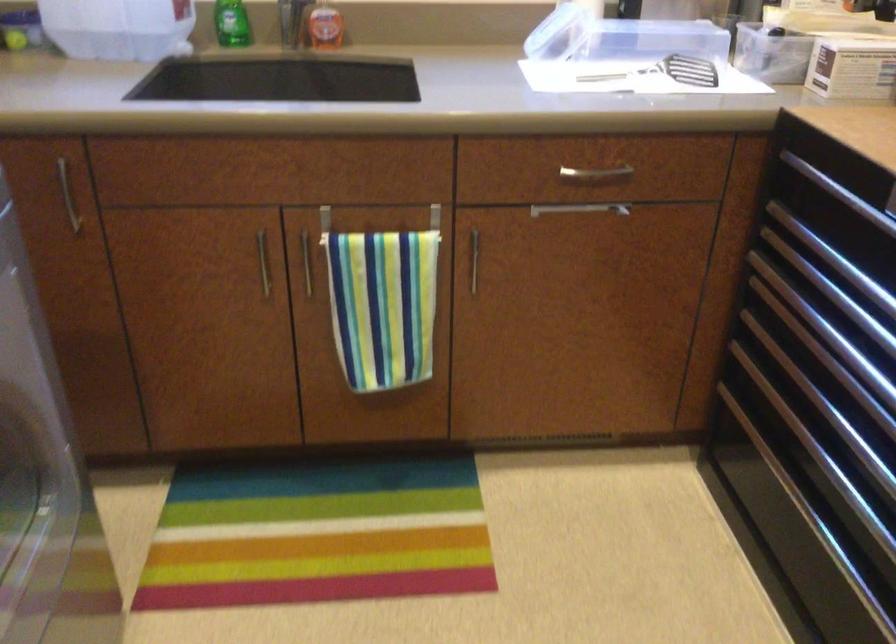
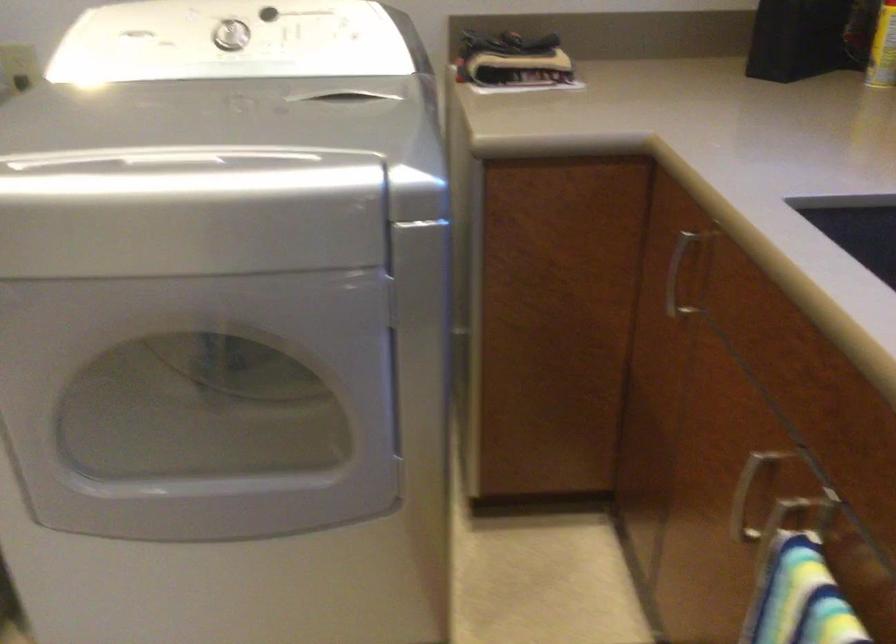
Where in the second image is the point corresponding to [245,279] from the first image?

(745, 497)